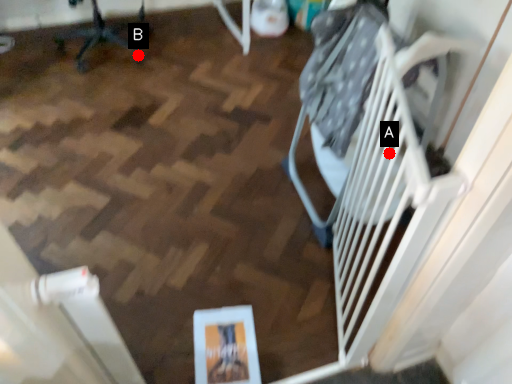
Question: Two points are circled on the image, labeled by A and B beside each circle. Which point is closer to the camera?

Choices:
 (A) A is closer
 (B) B is closer

Answer: (A)